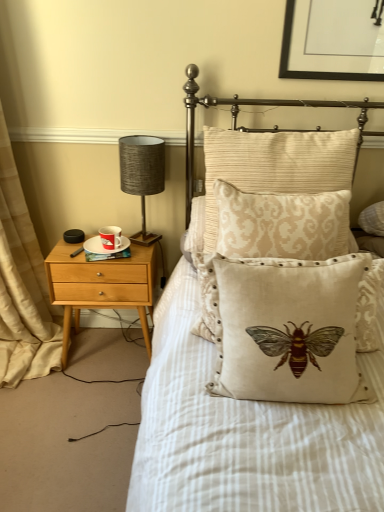
Question: Is point (132, 236) positioned closer to the camera than point (119, 236)?

Choices:
 (A) closer
 (B) farther

Answer: (B)

Question: Do you think textured gray lampshade at left is within red glossy mug at left, or outside of it?

Choices:
 (A) inside
 (B) outside

Answer: (B)

Question: Which is farther from the white ceramic saucer at left?

Choices:
 (A) light wood/finely crafted nightstand at left
 (B) red glossy mug at left
 (C) beige fabric curtain at left
 (D) textured gray lampshade at left
 (E) beige damask pillow at center, which ranks as the 3th pillow in front-to-back order

Answer: (E)

Question: Based on their relative distances, which object is nearer to the beige damask pillow at center, which is the 2th pillow in back-to-front order?

Choices:
 (A) beige fabric curtain at left
 (B) white ceramic saucer at left
 (C) red glossy mug at left
 (D) light wood/finely crafted nightstand at left
 (E) beige embroidered cushion with bee design at center, the 3th pillow in the back-to-front sequence

Answer: (E)